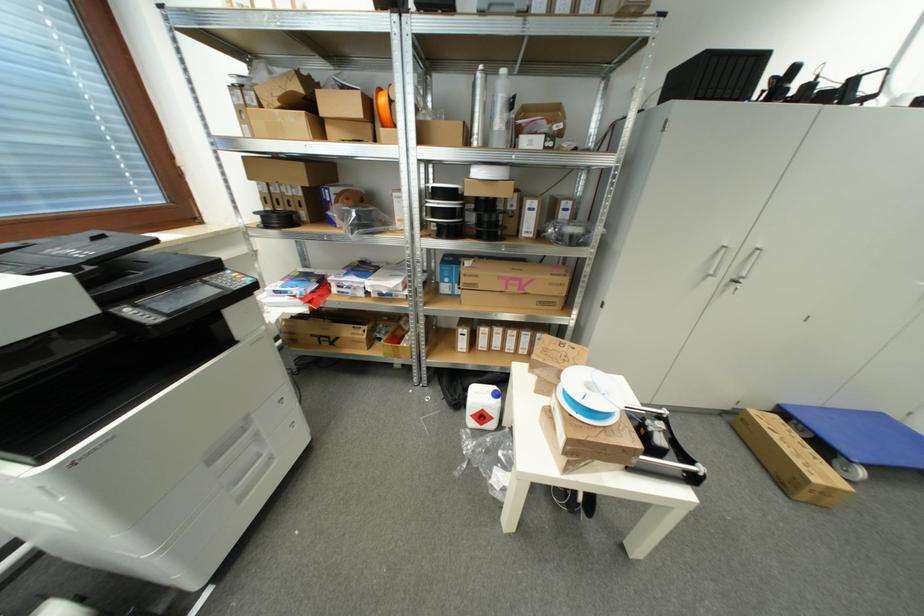
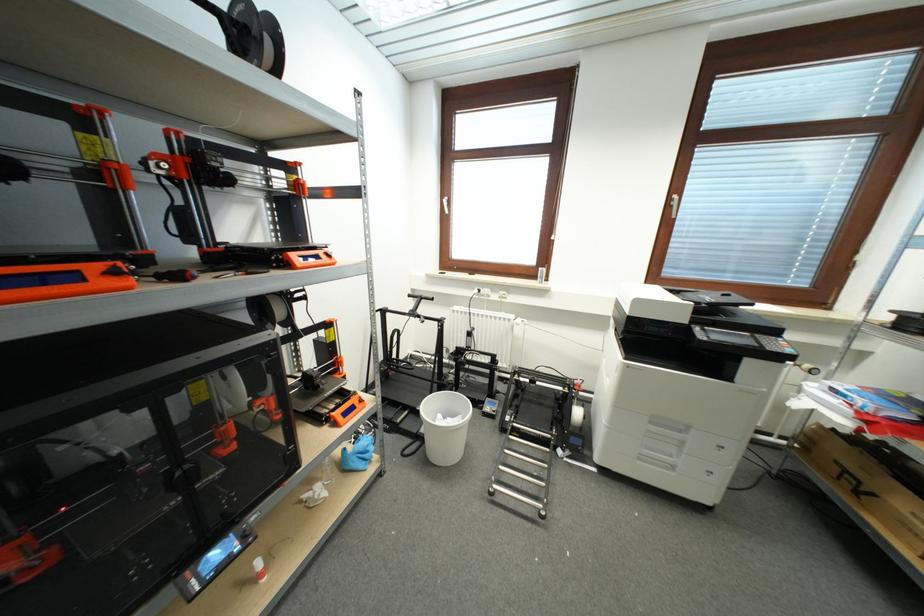
The point at (225, 466) is marked in the first image. Where is the corresponding point in the second image?

(658, 431)